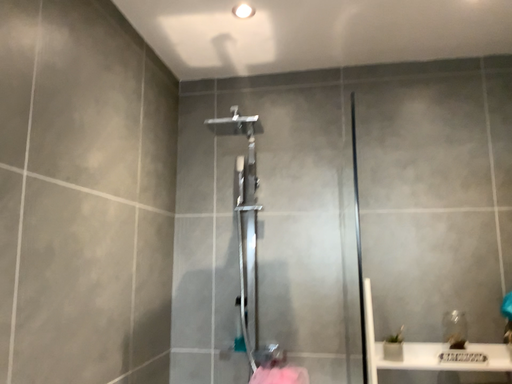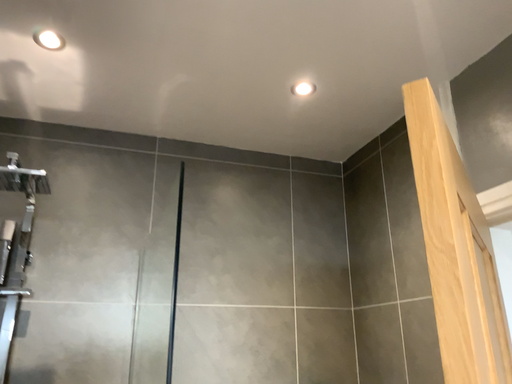
Question: How did the camera likely rotate when shooting the video?

Choices:
 (A) rotated upward
 (B) rotated downward

Answer: (A)